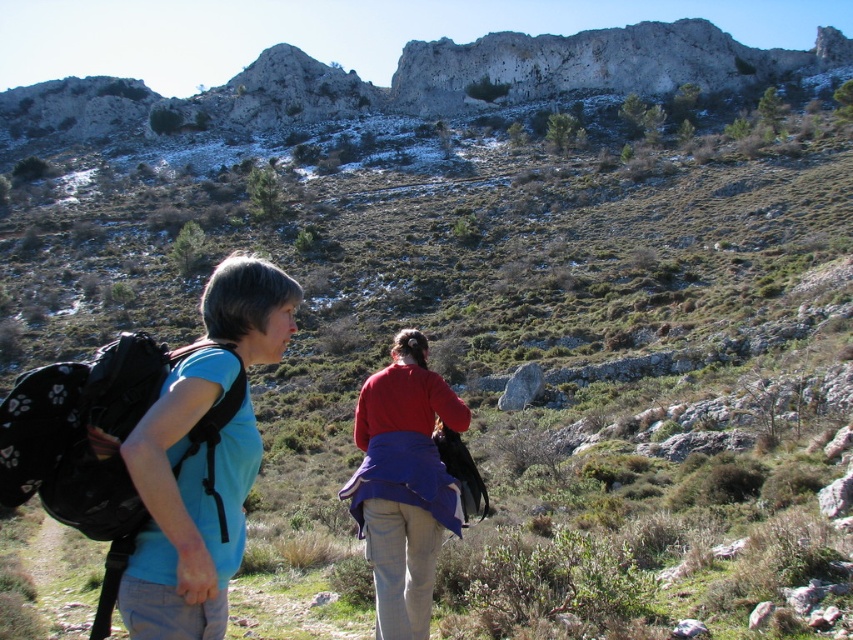
Question: Does blue fabric backpack at left appear on the left side of black fabric backpack at left?

Choices:
 (A) no
 (B) yes

Answer: (A)

Question: Which point is closer to the camera?

Choices:
 (A) matte red sweater at center
 (B) blue fabric backpack at left
 (C) black fabric backpack at left

Answer: (C)

Question: Which object is the closest to the matte red sweater at center?

Choices:
 (A) black fabric backpack at left
 (B) blue fabric backpack at left

Answer: (B)

Question: Does black fabric backpack at left have a lesser width compared to matte red sweater at center?

Choices:
 (A) no
 (B) yes

Answer: (A)

Question: Can you confirm if blue fabric backpack at left is thinner than black fabric backpack at left?

Choices:
 (A) no
 (B) yes

Answer: (B)

Question: Which object appears closest to the camera in this image?

Choices:
 (A) matte red sweater at center
 (B) black fabric backpack at left

Answer: (B)